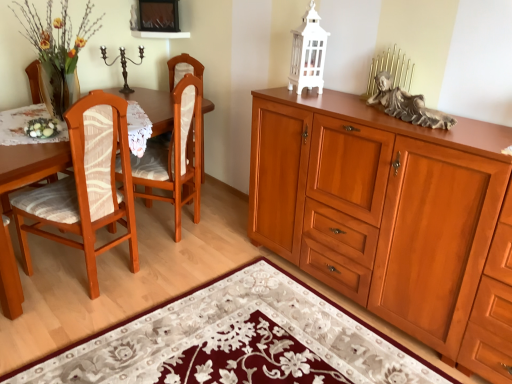
Locate an element on the screen. free spot to the right of wooden chair at left, placed as the first chair when sorted from front to back is located at coordinates (160, 279).